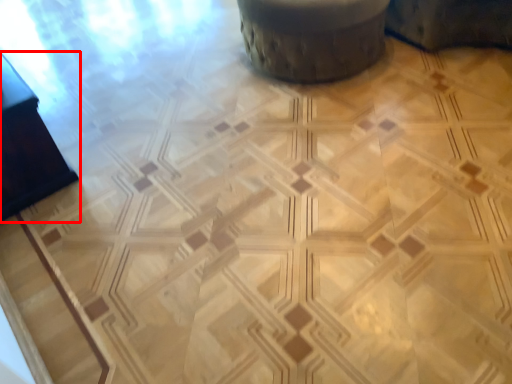
Question: From the image's perspective, considering the relative positions of furniture (annotated by the red box) and swivel chair in the image provided, where is furniture (annotated by the red box) located with respect to the staircase?

Choices:
 (A) below
 (B) above

Answer: (A)